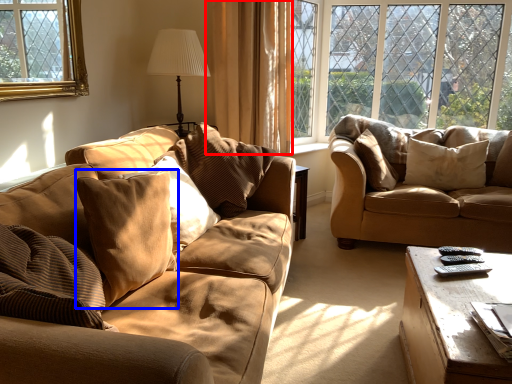
Question: Which object is closer to the camera taking this photo, curtain (highlighted by a red box) or pillow (highlighted by a blue box)?

Choices:
 (A) curtain
 (B) pillow

Answer: (B)